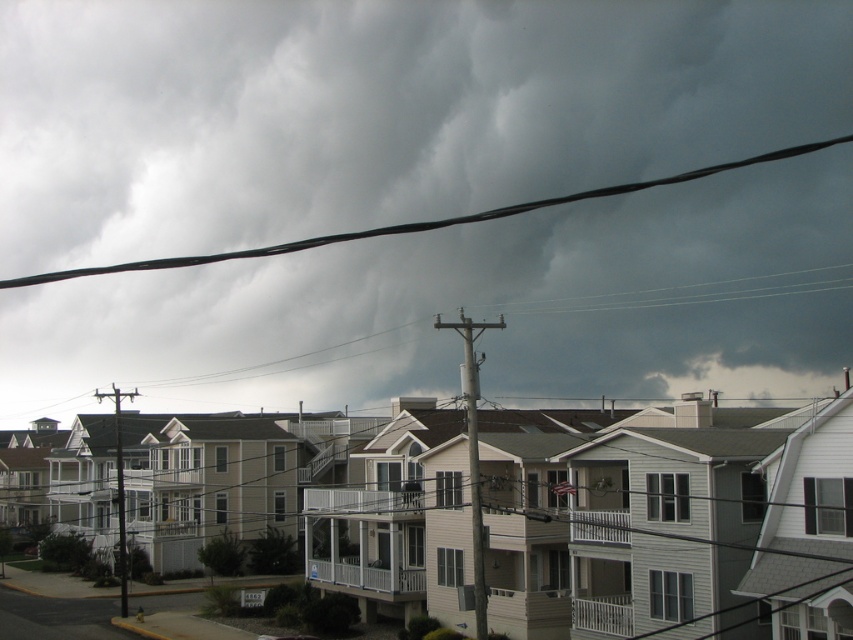
You are a delivery drone flying above the residential street scene. You need to navigate between the black wire at upper center and the gray metallic pole at center. Which object is higher in elevation?

The black wire at upper center is taller than the gray metallic pole at center, so the black wire is higher in elevation.

You are a bird flying over the residential street scene. You want to land on the highest point between the dark gray cloud at upper center and the black wire at upper center. Which one should you choose?

The dark gray cloud at upper center is located above the black wire at upper center, so you should choose the dark gray cloud at upper center to land on the highest point.